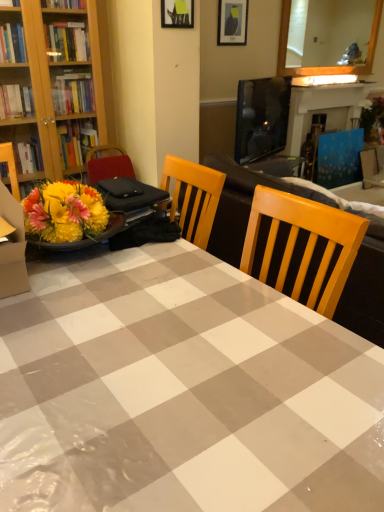
Question: Can we say blue painted wood fireplace at upper right lies outside blue fabric armchair at right?

Choices:
 (A) yes
 (B) no

Answer: (A)

Question: From a real-world perspective, is blue painted wood fireplace at upper right over blue fabric armchair at right?

Choices:
 (A) yes
 (B) no

Answer: (A)

Question: Is blue painted wood fireplace at upper right surrounding blue fabric armchair at right?

Choices:
 (A) yes
 (B) no

Answer: (A)

Question: Can you confirm if blue painted wood fireplace at upper right is taller than blue fabric armchair at right?

Choices:
 (A) yes
 (B) no

Answer: (A)

Question: Considering the relative sizes of blue painted wood fireplace at upper right and blue fabric armchair at right in the image provided, is blue painted wood fireplace at upper right shorter than blue fabric armchair at right?

Choices:
 (A) no
 (B) yes

Answer: (A)

Question: From the image's perspective, is wooden frame mirror at upper right above or below metallic silver picture frame at upper center, which is the 1th picture frame in left-to-right order?

Choices:
 (A) below
 (B) above

Answer: (B)

Question: Is wooden frame mirror at upper right in front of or behind metallic silver picture frame at upper center, which is the second picture frame from right to left, in the image?

Choices:
 (A) behind
 (B) front

Answer: (A)

Question: Is wooden frame mirror at upper right inside the boundaries of metallic silver picture frame at upper center, which is the second picture frame from right to left, or outside?

Choices:
 (A) inside
 (B) outside

Answer: (B)

Question: In the image, is wooden frame mirror at upper right on the left side or the right side of metallic silver picture frame at upper center, which is the 1th picture frame in left-to-right order?

Choices:
 (A) right
 (B) left

Answer: (A)

Question: Based on their sizes in the image, would you say gray checkered tablecloth at center is bigger or smaller than blue painted wood fireplace at upper right?

Choices:
 (A) big
 (B) small

Answer: (A)

Question: From the image's perspective, is gray checkered tablecloth at center above or below blue painted wood fireplace at upper right?

Choices:
 (A) below
 (B) above

Answer: (A)

Question: Is gray checkered tablecloth at center to the left or to the right of blue painted wood fireplace at upper right in the image?

Choices:
 (A) left
 (B) right

Answer: (A)

Question: Considering the positions of gray checkered tablecloth at center and blue painted wood fireplace at upper right in the image, is gray checkered tablecloth at center wider or thinner than blue painted wood fireplace at upper right?

Choices:
 (A) thin
 (B) wide

Answer: (B)

Question: Is blue painted wood fireplace at upper right wider or thinner than wooden frame mirror at upper right?

Choices:
 (A) thin
 (B) wide

Answer: (B)

Question: From the image's perspective, relative to wooden frame mirror at upper right, is blue painted wood fireplace at upper right above or below?

Choices:
 (A) below
 (B) above

Answer: (A)